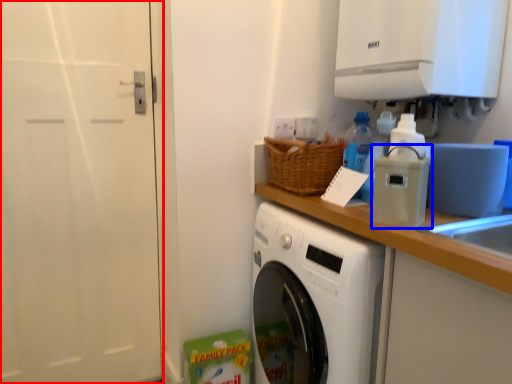
Question: Among these objects, which one is nearest to the camera, screen door (highlighted by a red box) or appliance (highlighted by a blue box)?

Choices:
 (A) screen door
 (B) appliance

Answer: (B)